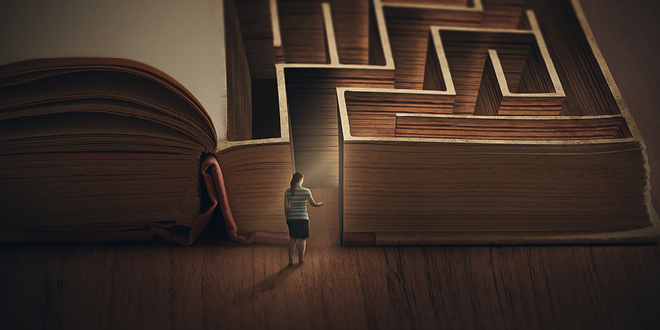
What are the coordinates of `book cover at spine` in the screenshot? It's located at (193, 243).